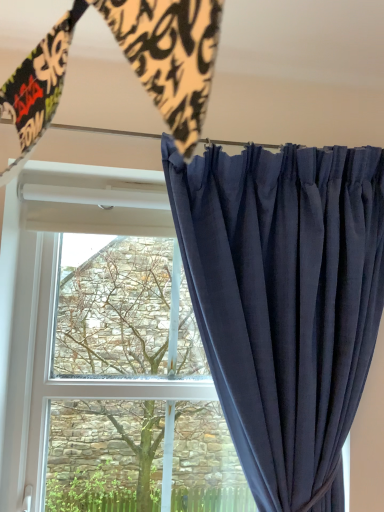
Where is `navy blue velvet curtain at right`? The height and width of the screenshot is (512, 384). navy blue velvet curtain at right is located at coordinates (284, 302).

This screenshot has height=512, width=384. What do you see at coordinates (284, 302) in the screenshot?
I see `navy blue velvet curtain at right` at bounding box center [284, 302].

What do you see at coordinates (136, 456) in the screenshot? I see `green leafy tree at center` at bounding box center [136, 456].

What is the approximate width of green leafy tree at center?

The width of green leafy tree at center is 2.73 inches.

Where is `green leafy tree at center`? This screenshot has width=384, height=512. green leafy tree at center is located at coordinates (136, 456).

Measure the distance between point (73, 246) and camera.

They are 1.27 meters apart.

Find the location of a particular element. The height and width of the screenshot is (512, 384). navy blue velvet curtain at right is located at coordinates (284, 302).

Considering the relative positions of green leafy tree at center and navy blue velvet curtain at right in the image provided, is green leafy tree at center to the right of navy blue velvet curtain at right from the viewer's perspective?

In fact, green leafy tree at center is to the left of navy blue velvet curtain at right.

In the scene shown: Relative to navy blue velvet curtain at right, is green leafy tree at center in front or behind?

green leafy tree at center is behind navy blue velvet curtain at right.

Which point is more forward, [182,406] or [284,314]?

Point [284,314]

From the image's perspective, does green leafy tree at center appear lower than navy blue velvet curtain at right?

Yes, from the image's perspective, green leafy tree at center is below navy blue velvet curtain at right.

From a real-world perspective, relative to navy blue velvet curtain at right, is green leafy tree at center vertically above or below?

green leafy tree at center is situated lower than navy blue velvet curtain at right in the real world.

Is green leafy tree at center thinner than navy blue velvet curtain at right?

Correct, the width of green leafy tree at center is less than that of navy blue velvet curtain at right.

In terms of height, does green leafy tree at center look taller or shorter compared to navy blue velvet curtain at right?

Considering their sizes, green leafy tree at center has less height than navy blue velvet curtain at right.

From the picture: Which of these two, green leafy tree at center or navy blue velvet curtain at right, is smaller?

With smaller size is green leafy tree at center.

Is navy blue velvet curtain at right inside green leafy tree at center?

No, navy blue velvet curtain at right is located outside of green leafy tree at center.

Does green leafy tree at center touch navy blue velvet curtain at right?

No.

Could you tell me if green leafy tree at center is turned towards navy blue velvet curtain at right?

No.

In the image, there is a navy blue velvet curtain at right. At what (x,y) coordinates should I click in order to perform the action: click on tree below it (from a real-world perspective). Please return your answer as a coordinate pair (x, y). The height and width of the screenshot is (512, 384). Looking at the image, I should click on (136, 456).

Can you confirm if navy blue velvet curtain at right is positioned to the right of green leafy tree at center?

Yes.

Is the position of navy blue velvet curtain at right less distant than that of green leafy tree at center?

Yes, it is.

Is point (369, 356) closer or farther from the camera than point (66, 307)?

Point (369, 356) is closer to the camera than point (66, 307).

From the image's perspective, between navy blue velvet curtain at right and green leafy tree at center, which one is located above?

navy blue velvet curtain at right is shown above in the image.

From a real-world perspective, is navy blue velvet curtain at right below green leafy tree at center?

Actually, navy blue velvet curtain at right is physically above green leafy tree at center in the real world.

Between navy blue velvet curtain at right and green leafy tree at center, which one has smaller width?

green leafy tree at center is thinner.

Which of these two, navy blue velvet curtain at right or green leafy tree at center, stands taller?

navy blue velvet curtain at right is taller.

Between navy blue velvet curtain at right and green leafy tree at center, which one has smaller size?

green leafy tree at center is smaller.

Is navy blue velvet curtain at right positioned beyond the bounds of green leafy tree at center?

Indeed, navy blue velvet curtain at right is completely outside green leafy tree at center.

Is navy blue velvet curtain at right not near green leafy tree at center?

navy blue velvet curtain at right is near green leafy tree at center, not far away.

Based on the photo, is navy blue velvet curtain at right positioned with its back to green leafy tree at center?

→ No, green leafy tree at center is not at the back of navy blue velvet curtain at right.

What's the angular difference between navy blue velvet curtain at right and green leafy tree at center's facing directions?

1.7 degrees.

Measure the distance between navy blue velvet curtain at right and green leafy tree at center.

navy blue velvet curtain at right and green leafy tree at center are 35.70 centimeters apart from each other.

You are a GUI agent. You are given a task and a screenshot of the screen. Output one action in this format:
    pyautogui.click(x=<x>, y=<y>)
    Task: Click on the tree behind the navy blue velvet curtain at right
    This screenshot has width=384, height=512.
    Given the screenshot: What is the action you would take?
    pyautogui.click(x=136, y=456)

Where is `tree located on the left of navy blue velvet curtain at right`? Image resolution: width=384 pixels, height=512 pixels. tree located on the left of navy blue velvet curtain at right is located at coordinates (136, 456).

At what (x,y) coordinates should I click in order to perform the action: click on curtain above the green leafy tree at center (from a real-world perspective). Please return your answer as a coordinate pair (x, y). The image size is (384, 512). Looking at the image, I should click on (284, 302).